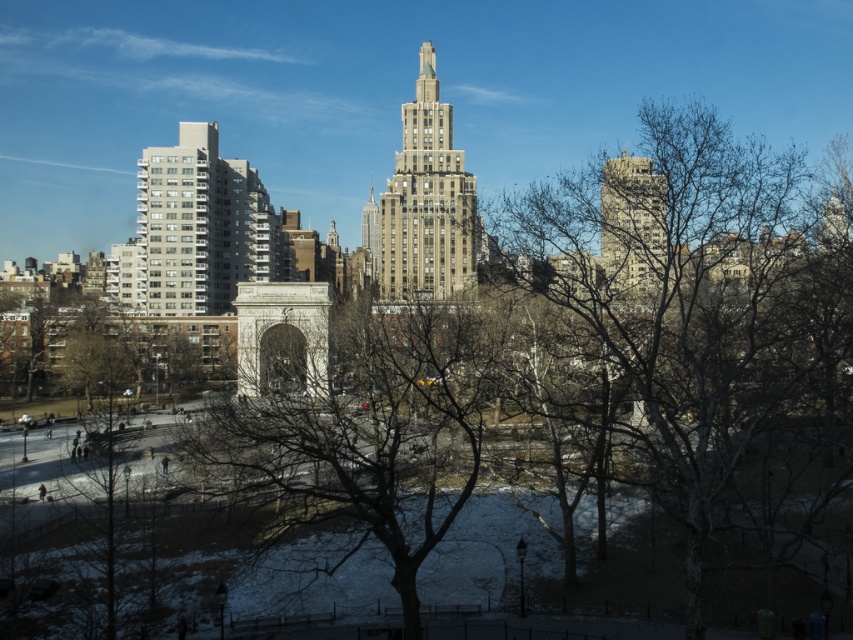
Question: Which object is closer to the camera taking this photo?

Choices:
 (A) gray concrete building at left
 (B) bare bark tree at center
 (C) brown textured building at center
 (D) smooth concrete building at upper right

Answer: (B)

Question: Does bare wood tree at center appear over gray concrete building at left?

Choices:
 (A) no
 (B) yes

Answer: (A)

Question: Does brown textured building at center appear over smooth concrete building at upper right?

Choices:
 (A) no
 (B) yes

Answer: (B)

Question: Which point appears closest to the camera in this image?

Choices:
 (A) 637,220
 (B) 254,216

Answer: (A)

Question: Which is farther from the smooth beige skyscraper at center?

Choices:
 (A) brown textured building at center
 (B) bare bark tree at center

Answer: (B)

Question: Can you confirm if bare wood tree at center is positioned to the right of smooth beige skyscraper at center?

Choices:
 (A) no
 (B) yes

Answer: (B)